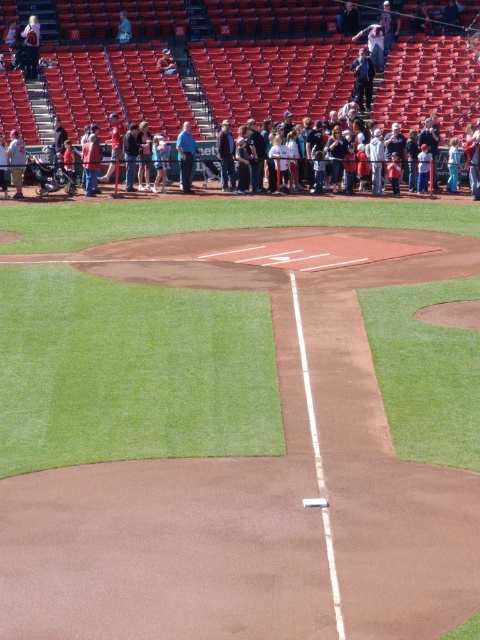
You are standing at the pitcher mound and want to take a photo of the point at coordinates [178,150]. If the camera you are using has a maximum range of 90 feet, will you be able to capture the point in your photo?

The point at coordinates [178,150] is 93.40 feet away from the camera, which exceeds the camera maximum range of 90 feet. Therefore, you won not be able to capture the point in your photo.